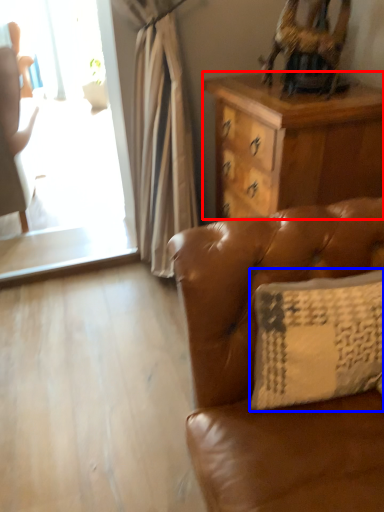
Question: Among these objects, which one is farthest to the camera, desk (highlighted by a red box) or pillow (highlighted by a blue box)?

Choices:
 (A) desk
 (B) pillow

Answer: (A)